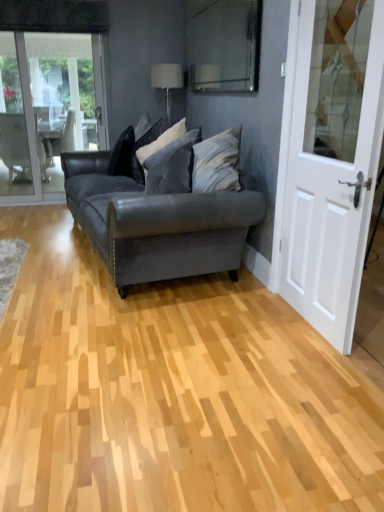
Question: Would you say matte black couch at center is part of velvet gray pillow at center, which is counted as the first pillow, starting from the right,'s contents?

Choices:
 (A) yes
 (B) no

Answer: (B)

Question: Could you tell me if velvet gray pillow at center, the 3th pillow viewed from the left, is turned towards matte black couch at center?

Choices:
 (A) no
 (B) yes

Answer: (B)

Question: Considering the relative sizes of velvet gray pillow at center, which is counted as the first pillow, starting from the right, and matte black couch at center in the image provided, is velvet gray pillow at center, which is counted as the first pillow, starting from the right, smaller than matte black couch at center?

Choices:
 (A) no
 (B) yes

Answer: (B)

Question: Is velvet gray pillow at center, which is counted as the first pillow, starting from the right, positioned with its back to matte black couch at center?

Choices:
 (A) yes
 (B) no

Answer: (A)

Question: Is velvet gray pillow at center, which is counted as the first pillow, starting from the right, thinner than matte black couch at center?

Choices:
 (A) yes
 (B) no

Answer: (A)

Question: In terms of size, does velvet gray pillow at center, the 3th pillow viewed from the left, appear bigger or smaller than velvet black pillow at center, the 2th pillow viewed from the right?

Choices:
 (A) small
 (B) big

Answer: (B)

Question: From a real-world perspective, is velvet gray pillow at center, the 3th pillow viewed from the left, positioned above or below velvet black pillow at center, which is the second pillow from left to right?

Choices:
 (A) above
 (B) below

Answer: (B)

Question: Would you say velvet gray pillow at center, the 3th pillow viewed from the left, is to the left or to the right of velvet black pillow at center, which is the second pillow from left to right, in the picture?

Choices:
 (A) right
 (B) left

Answer: (A)

Question: Considering their positions, is velvet gray pillow at center, which is counted as the first pillow, starting from the right, located in front of or behind velvet black pillow at center, which is the second pillow from left to right?

Choices:
 (A) front
 (B) behind

Answer: (A)

Question: Considering the positions of white fabric lampshade at upper center and velvet black pillow at center, which ranks as the first pillow in left-to-right order, in the image, is white fabric lampshade at upper center wider or thinner than velvet black pillow at center, which ranks as the first pillow in left-to-right order,?

Choices:
 (A) thin
 (B) wide

Answer: (B)

Question: Would you say white fabric lampshade at upper center is inside or outside velvet black pillow at center, which ranks as the first pillow in left-to-right order?

Choices:
 (A) outside
 (B) inside

Answer: (A)

Question: Considering the positions of white fabric lampshade at upper center and velvet black pillow at center, the 3th pillow when ordered from right to left, in the image, is white fabric lampshade at upper center taller or shorter than velvet black pillow at center, the 3th pillow when ordered from right to left,?

Choices:
 (A) tall
 (B) short

Answer: (A)

Question: From a real-world perspective, is white fabric lampshade at upper center positioned above or below velvet black pillow at center, the 3th pillow when ordered from right to left?

Choices:
 (A) above
 (B) below

Answer: (A)

Question: Is velvet gray pillow at center, the 3th pillow viewed from the left, bigger or smaller than matte black couch at center?

Choices:
 (A) small
 (B) big

Answer: (A)

Question: Considering the positions of point (175, 185) and point (163, 218), is point (175, 185) closer or farther from the camera than point (163, 218)?

Choices:
 (A) farther
 (B) closer

Answer: (A)